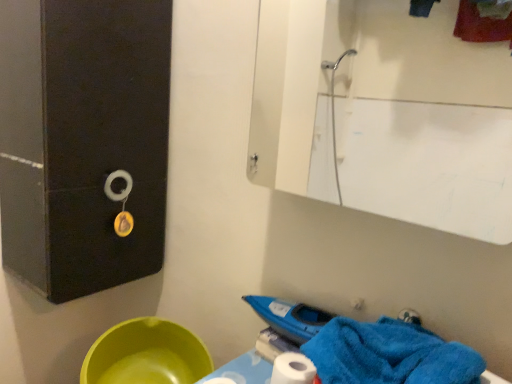
Question: Based on their sizes in the image, would you say blue soft towel at lower right is bigger or smaller than white glossy mirror at upper center?

Choices:
 (A) big
 (B) small

Answer: (B)

Question: From a real-world perspective, relative to white glossy mirror at upper center, is blue soft towel at lower right vertically above or below?

Choices:
 (A) below
 (B) above

Answer: (A)

Question: Estimate the real-world distances between objects in this image. Which object is closer to the green plastic basin at lower left?

Choices:
 (A) blue soft towel at lower right
 (B) white glossy mirror at upper center

Answer: (A)

Question: Estimate the real-world distances between objects in this image. Which object is closer to the blue soft towel at lower right?

Choices:
 (A) white glossy mirror at upper center
 (B) green plastic basin at lower left

Answer: (B)